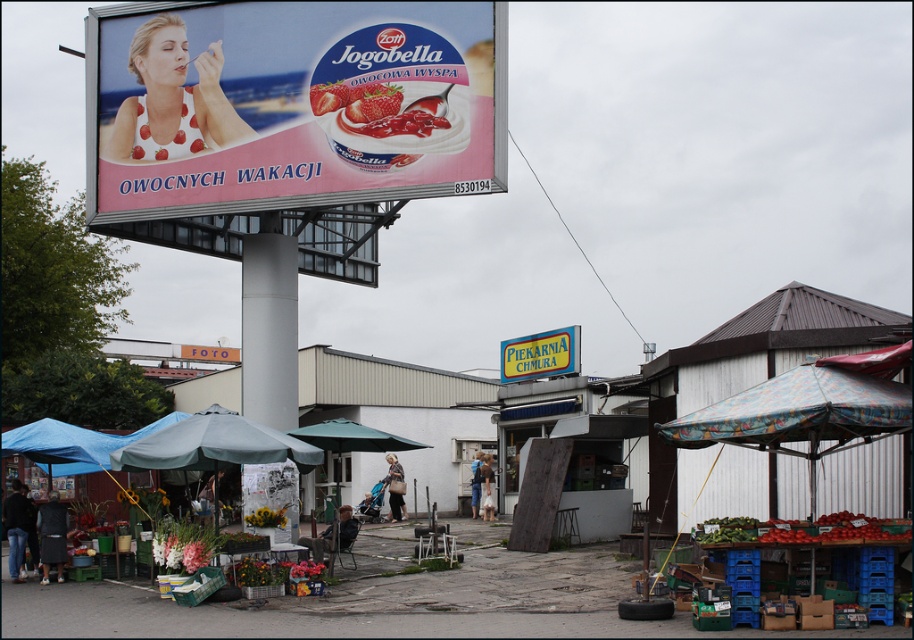
Question: Which object is closer to the camera taking this photo?

Choices:
 (A) matte plastic billboard at upper center
 (B) metallic silver sign at center

Answer: (A)

Question: Which is nearer to the metallic silver sign at center?

Choices:
 (A) yellow plastic sign at center
 (B) matte plastic billboard at upper center
 (C) orange fabric sign at center

Answer: (B)

Question: Does matte plastic billboard at upper center appear under blue fabric umbrella at center?

Choices:
 (A) no
 (B) yes

Answer: (A)

Question: Which point is farther to the camera?

Choices:
 (A) orange fabric sign at center
 (B) metallic silver sign at center
 (C) matte plastic billboard at upper center

Answer: (A)

Question: Where is matte plastic billboard at upper center located in relation to orange fabric sign at center in the image?

Choices:
 (A) right
 (B) left

Answer: (A)

Question: From the image, what is the correct spatial relationship of matte plastic billboard at upper center in relation to yellow plastic sign at center?

Choices:
 (A) below
 (B) above

Answer: (B)